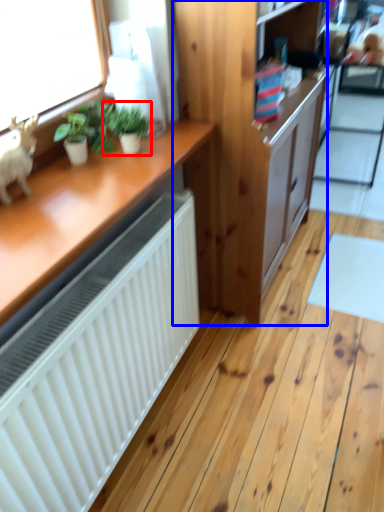
Question: Among these objects, which one is farthest to the camera, houseplant (highlighted by a red box) or cabinetry (highlighted by a blue box)?

Choices:
 (A) houseplant
 (B) cabinetry

Answer: (B)